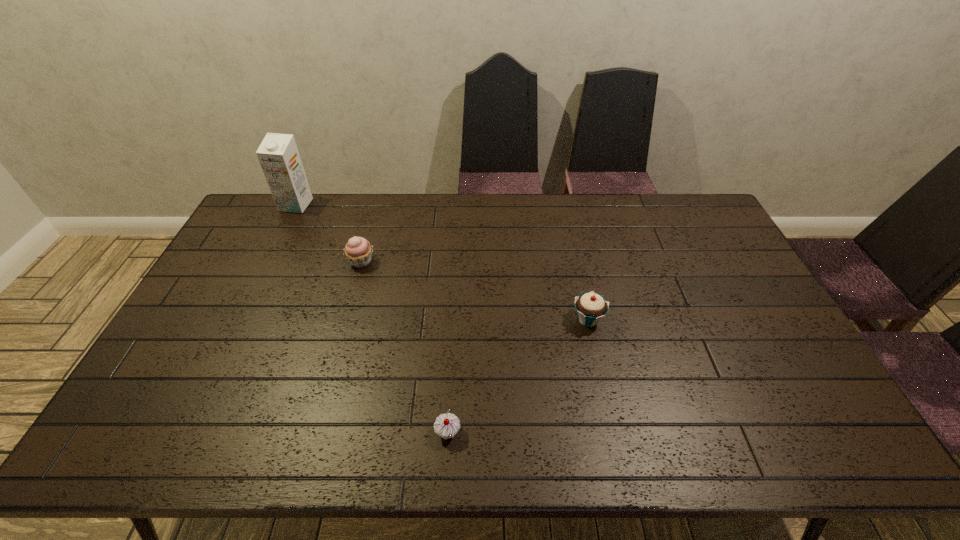
At what (x,y) coordinates should I click in order to perform the action: click on empty space that is in between the third object from left to right and the carton. Please return your answer as a coordinate pair (x, y). Looking at the image, I should click on (372, 319).

You are a GUI agent. You are given a task and a screenshot of the screen. Output one action in this format:
    pyautogui.click(x=<x>, y=<y>)
    Task: Click on the free space between the leftmost object and the leftmost cupcake
    This screenshot has width=960, height=540.
    Given the screenshot: What is the action you would take?
    pyautogui.click(x=328, y=233)

Locate an element on the screen. The image size is (960, 540). free area in between the third farthest object and the third object from right to left is located at coordinates (474, 291).

Identify which object is located as the nearest to the carton. Please provide its 2D coordinates. Your answer should be formatted as a tuple, i.e. [(x, y)], where the tuple contains the x and y coordinates of a point satisfying the conditions above.

[(358, 251)]

You are a GUI agent. You are given a task and a screenshot of the screen. Output one action in this format:
    pyautogui.click(x=<x>, y=<y>)
    Task: Click on the object that ranks as the third closest to the tallest object
    This screenshot has height=540, width=960.
    Given the screenshot: What is the action you would take?
    pyautogui.click(x=591, y=307)

Where is `cupcake that stands as the closest to the nearest object`? This screenshot has width=960, height=540. cupcake that stands as the closest to the nearest object is located at coordinates (591, 307).

Identify which cupcake is located as the second nearest to the tallest object. Please provide its 2D coordinates. Your answer should be formatted as a tuple, i.e. [(x, y)], where the tuple contains the x and y coordinates of a point satisfying the conditions above.

[(447, 425)]

Identify the location of free space that satisfies the following two spatial constraints: 1. on the front side of the farthest object; 2. on the left side of the nearest object. This screenshot has height=540, width=960. (182, 433).

Find the location of a particular element. This screenshot has width=960, height=540. vacant space that satisfies the following two spatial constraints: 1. on the back side of the second nearest cupcake; 2. on the right side of the nearest cupcake is located at coordinates (454, 319).

The image size is (960, 540). Find the location of `vacant space that satisfies the following two spatial constraints: 1. on the front side of the third nearest object; 2. on the left side of the carton`. vacant space that satisfies the following two spatial constraints: 1. on the front side of the third nearest object; 2. on the left side of the carton is located at coordinates [268, 261].